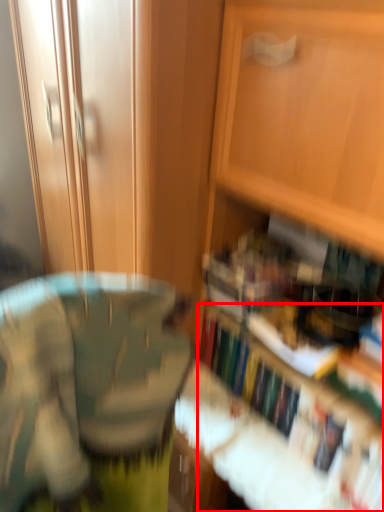
Question: Considering the relative positions of book (annotated by the red box) and cabinetry in the image provided, where is book (annotated by the red box) located with respect to the staircase?

Choices:
 (A) right
 (B) left

Answer: (A)